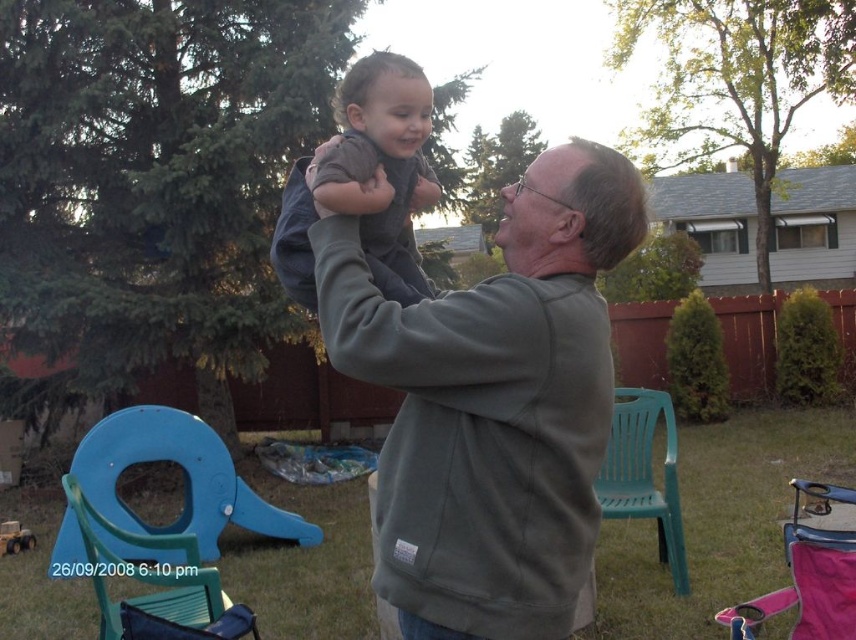
You are planning to place a large potted plant that requires a sturdy chair to hold it. Based on the scene, which chair between the pink fabric chair at lower right and the green plastic chair at right would be more suitable for this purpose?

The pink fabric chair at lower right is larger and thus more likely to be sturdy enough to hold the large potted plant compared to the green plastic chair at right.

You are setting up a picnic area in the backyard and have two chairs available. The pink fabric chair at lower right and the green plastic chair at right. Which chair should you choose if you want to accommodate a larger person comfortably?

The pink fabric chair at lower right might be wider than green plastic chair at right, so it is more suitable for accommodating a larger person comfortably.